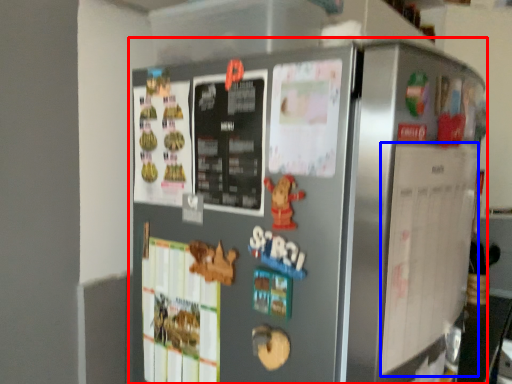
Question: Which object is closer to the camera taking this photo, refrigerator (highlighted by a red box) or bulletin board (highlighted by a blue box)?

Choices:
 (A) refrigerator
 (B) bulletin board

Answer: (A)